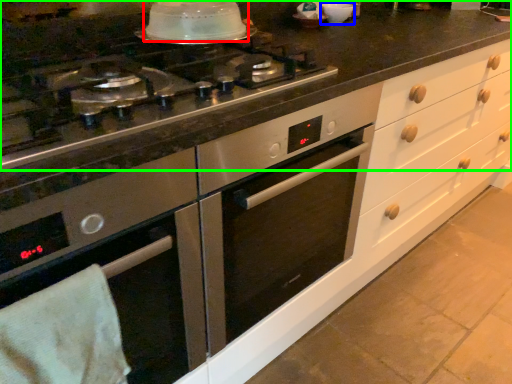
Question: Which object is the farthest from kitchen appliance (highlighted by a red box)? Choose among these: appliance (highlighted by a blue box) or countertop (highlighted by a green box).

Choices:
 (A) appliance
 (B) countertop

Answer: (A)